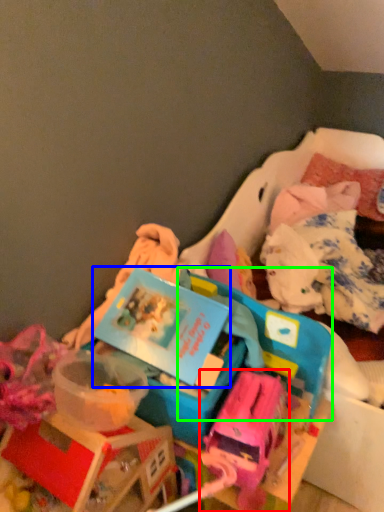
Question: Which object is positioned closest to toy (highlighted by a red box)? Select from kit (highlighted by a blue box) and storage box (highlighted by a green box).

Choices:
 (A) kit
 (B) storage box

Answer: (B)